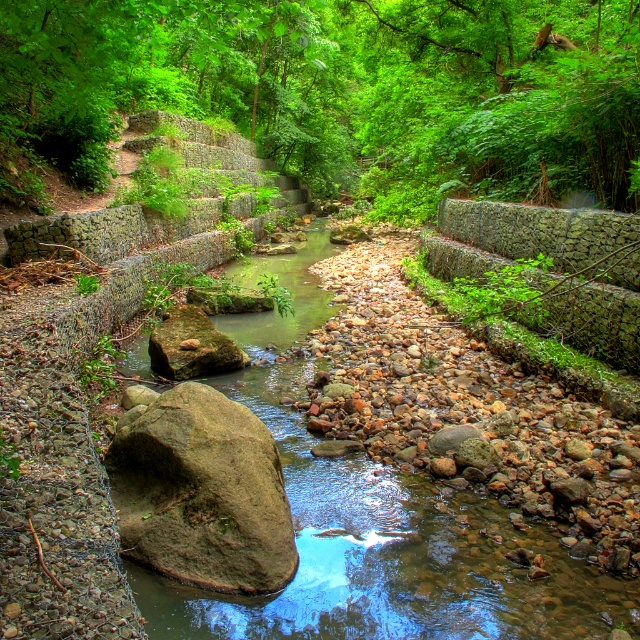
Does point (566, 45) come behind point (280, 368)?

Yes.

Is green leafy forest at center above smooth stone stream at center?

Indeed, green leafy forest at center is positioned over smooth stone stream at center.

Which is behind, point (300, 170) or point (285, 589)?

The point (300, 170) is behind.

At what (x,y) coordinates should I click in order to perform the action: click on green leafy forest at center. Please return your answer as a coordinate pair (x, y). Image resolution: width=640 pixels, height=640 pixels. Looking at the image, I should click on (346, 90).

Which is above, smooth stone stream at center or brown rough rock at center?

smooth stone stream at center

Is point (474, 609) positioned behind point (230, 467)?

That is False.

Is point (378, 609) positioned in front of point (154, 538)?

Yes, it is.

Where is `smooth stone stream at center`? This screenshot has height=640, width=640. smooth stone stream at center is located at coordinates (376, 515).

Is point (289, 13) less distant than point (182, 426)?

No.

Can you confirm if green leafy forest at center is positioned above brown rough rock at center?

Correct, green leafy forest at center is located above brown rough rock at center.

Between point (448, 17) and point (122, 531), which one is positioned in front?

Point (122, 531)

Locate an element on the screen. The image size is (640, 640). green leafy forest at center is located at coordinates (346, 90).